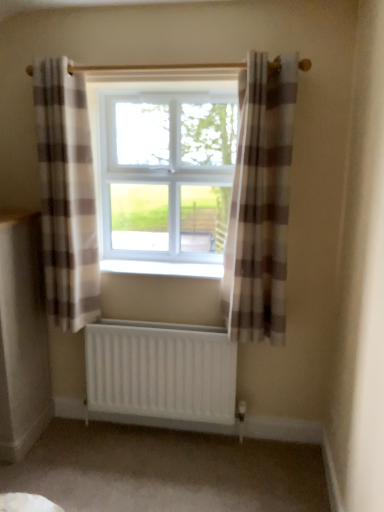
Question: Can you confirm if white plastic radiator at center is smaller than white matte radiator at lower center?

Choices:
 (A) no
 (B) yes

Answer: (B)

Question: From the image's perspective, is white plastic radiator at center located beneath white matte radiator at lower center?

Choices:
 (A) yes
 (B) no

Answer: (B)

Question: Are white plastic radiator at center and white matte radiator at lower center far apart?

Choices:
 (A) yes
 (B) no

Answer: (B)

Question: From a real-world perspective, is white plastic radiator at center over white matte radiator at lower center?

Choices:
 (A) yes
 (B) no

Answer: (A)

Question: Does white plastic radiator at center lie behind white matte radiator at lower center?

Choices:
 (A) no
 (B) yes

Answer: (B)

Question: Do you think white matte radiator at lower center is within plaid fabric curtain at center, which ranks as the first curtain in right-to-left order, or outside of it?

Choices:
 (A) inside
 (B) outside

Answer: (B)

Question: In terms of height, does white matte radiator at lower center look taller or shorter compared to plaid fabric curtain at center, arranged as the second curtain when viewed from the left?

Choices:
 (A) tall
 (B) short

Answer: (B)

Question: In terms of width, does white matte radiator at lower center look wider or thinner when compared to plaid fabric curtain at center, which ranks as the first curtain in right-to-left order?

Choices:
 (A) wide
 (B) thin

Answer: (B)

Question: From the image's perspective, is white matte radiator at lower center located above or below plaid fabric curtain at center, which ranks as the first curtain in right-to-left order?

Choices:
 (A) below
 (B) above

Answer: (A)

Question: From the image's perspective, relative to white plastic window at center, is plaid fabric curtain at center, arranged as the second curtain when viewed from the left, above or below?

Choices:
 (A) below
 (B) above

Answer: (A)

Question: Relative to white plastic window at center, is plaid fabric curtain at center, arranged as the second curtain when viewed from the left, in front or behind?

Choices:
 (A) behind
 (B) front

Answer: (B)

Question: Is point (281, 229) positioned closer to the camera than point (216, 253)?

Choices:
 (A) farther
 (B) closer

Answer: (B)

Question: Do you think plaid fabric curtain at center, arranged as the second curtain when viewed from the left, is within white plastic window at center, or outside of it?

Choices:
 (A) outside
 (B) inside

Answer: (A)

Question: Is point (117, 262) positioned closer to the camera than point (163, 365)?

Choices:
 (A) farther
 (B) closer

Answer: (A)

Question: From their relative heights in the image, would you say white plastic radiator at center is taller or shorter than white matte radiator at lower center?

Choices:
 (A) short
 (B) tall

Answer: (A)